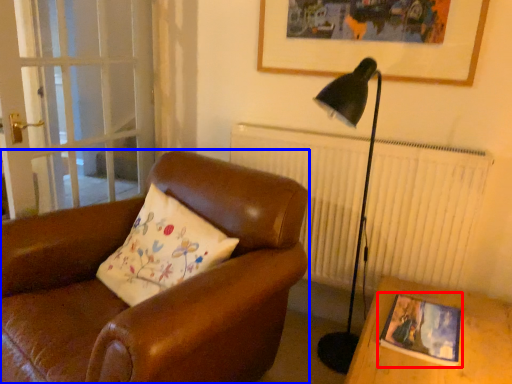
Question: Among these objects, which one is nearest to the camera, picture frame (highlighted by a red box) or chair (highlighted by a blue box)?

Choices:
 (A) picture frame
 (B) chair

Answer: (A)